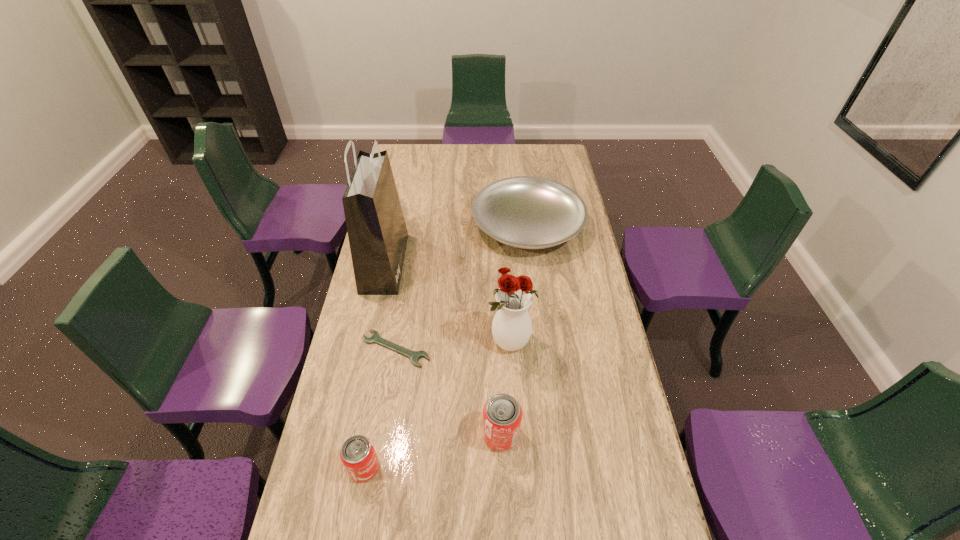
Where is `the third shortest object`? The width and height of the screenshot is (960, 540). the third shortest object is located at coordinates (358, 455).

Identify the location of the shorter can. This screenshot has height=540, width=960. (358, 455).

You are a GUI agent. You are given a task and a screenshot of the screen. Output one action in this format:
    pyautogui.click(x=<x>, y=<y>)
    Task: Click on the taller can
    This screenshot has width=960, height=540.
    Given the screenshot: What is the action you would take?
    pyautogui.click(x=502, y=414)

Locate an element on the screen. The height and width of the screenshot is (540, 960). the fourth shortest object is located at coordinates (502, 414).

Where is `the second shortest object`? The width and height of the screenshot is (960, 540). the second shortest object is located at coordinates (527, 212).

You are a GUI agent. You are given a task and a screenshot of the screen. Output one action in this format:
    pyautogui.click(x=<x>, y=<y>)
    Task: Click on the tallest object
    This screenshot has width=960, height=540.
    Given the screenshot: What is the action you would take?
    [x=377, y=232]

This screenshot has width=960, height=540. I want to click on the fifth shortest object, so click(511, 327).

Find the location of a particular element. wrench is located at coordinates (414, 356).

Find the location of a particular element. The image size is (960, 540). vacant space located on the front of the left can is located at coordinates (354, 522).

Identify the location of vacant region located on the left of the third tallest object. The image size is (960, 540). (395, 435).